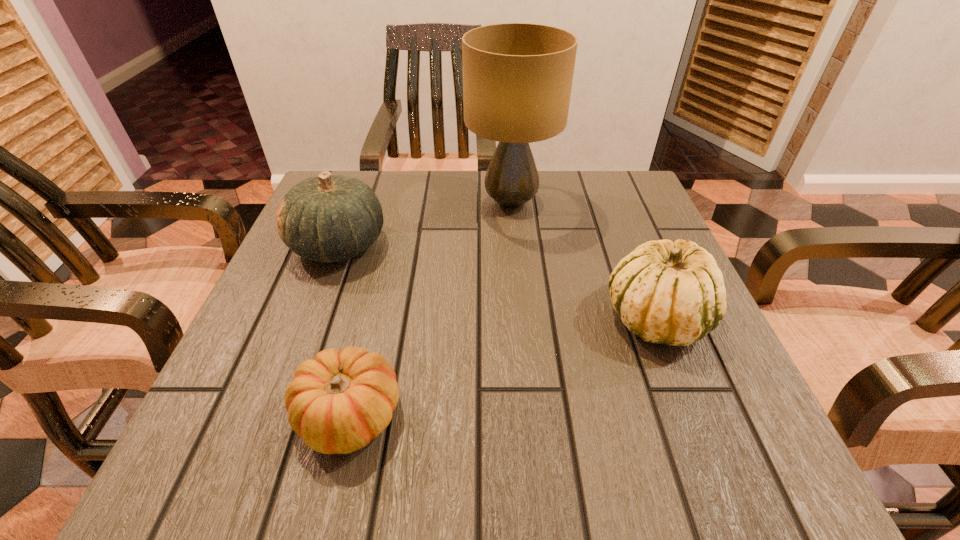
Where is `free space at the right edge of the desktop`? free space at the right edge of the desktop is located at coordinates (610, 271).

In the image, there is a desktop. Where is `vacant space at the far left corner`? vacant space at the far left corner is located at coordinates (361, 180).

Find the location of `free space that is in between the rightmost object and the nearest gourd`. free space that is in between the rightmost object and the nearest gourd is located at coordinates (503, 366).

Locate an element on the screen. unoccupied position between the third farthest object and the nearest object is located at coordinates (503, 366).

Find the location of a particular element. This screenshot has width=960, height=540. free space between the lampshade and the shortest gourd is located at coordinates (430, 308).

Locate an element on the screen. vacant area that lies between the rightmost gourd and the nearest object is located at coordinates (503, 366).

Locate an element on the screen. This screenshot has height=540, width=960. free space that is in between the second nearest object and the shortest object is located at coordinates (503, 366).

The image size is (960, 540). I want to click on unoccupied position between the rightmost gourd and the nearest object, so click(x=503, y=366).

Find the location of `free point between the shortest gourd and the farthest gourd`. free point between the shortest gourd and the farthest gourd is located at coordinates (344, 330).

The image size is (960, 540). I want to click on vacant space in between the farthest gourd and the shortest object, so click(344, 330).